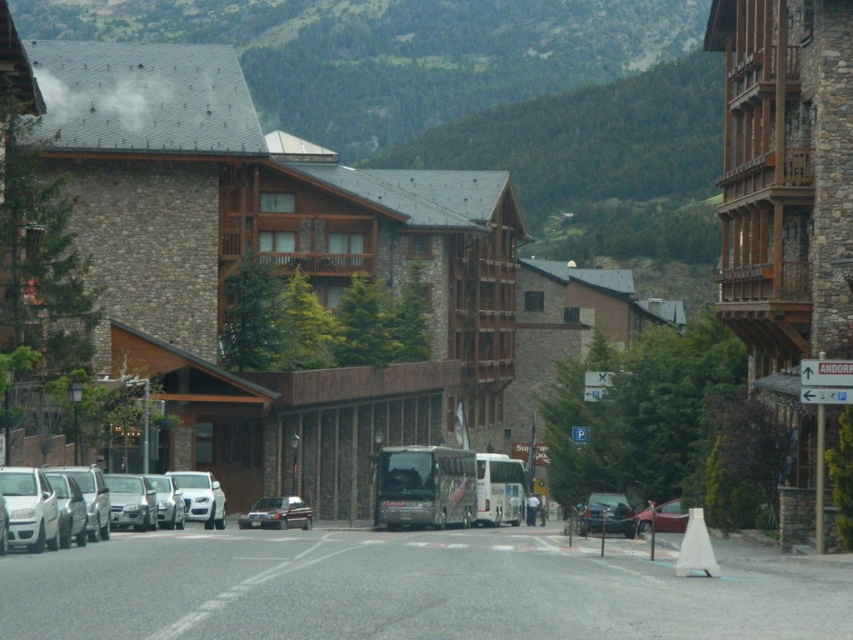
You are standing at the intersection and need to cross the street to reach the bus stop. The white matte car at left is blocking your path. Is the car positioned closer to the intersection or further away from it?

The white matte car at left is positioned closer to the intersection since its 2D location coordinate is at point [47,506], which is closer to the center of the image where the intersection is located.

You are a tourist standing at the pedestrian crossing in the middle of the street. You want to take a photo of the green grassy mountain at upper center without any vehicles blocking the view. Is the metallic silver sedan at center currently blocking your view of the mountain?

The green grassy mountain at upper center is above the metallic silver sedan at center, so the sedan is not blocking the view of the mountain since the mountain is positioned higher up.